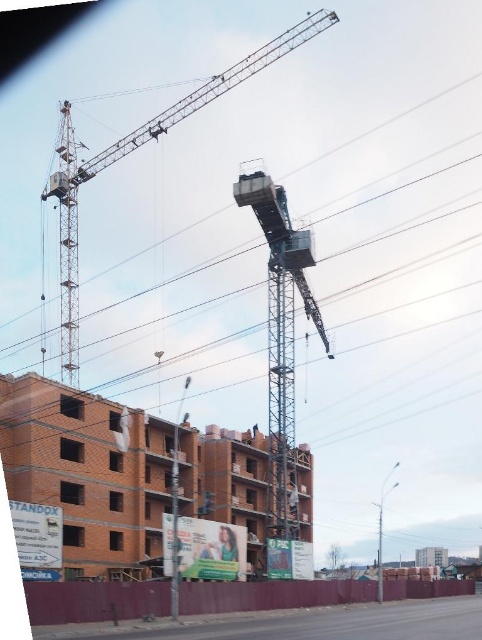
Who is more distant from viewer, (57, 428) or (288, 275)?

The point (288, 275) is behind.

Which of these two, brick building at center or metallic gray crane at center, stands shorter?

With less height is brick building at center.

Is point (156, 568) closer to camera compared to point (294, 493)?

Yes, point (156, 568) is in front of point (294, 493).

This screenshot has height=640, width=482. Find the location of `brick building at center`. brick building at center is located at coordinates (88, 472).

Which is behind, point (193, 476) or point (456, 579)?

Positioned behind is point (456, 579).

Is brick building at center smaller than brown brick wall at lower left?

Yes, brick building at center is smaller than brown brick wall at lower left.

Is point (36, 380) farther from viewer compared to point (121, 620)?

That is True.

This screenshot has height=640, width=482. Identify the location of brick building at center. (88, 472).

Between metallic gray crane at center and blue fabric construction worker at center, which one appears on the left side from the viewer's perspective?

blue fabric construction worker at center is more to the left.

Does metallic gray crane at center appear on the right side of blue fabric construction worker at center?

Correct, you'll find metallic gray crane at center to the right of blue fabric construction worker at center.

Is point (240, 176) farther from viewer compared to point (252, 435)?

That is False.

Where is `metallic gray crane at center`? metallic gray crane at center is located at coordinates (281, 339).